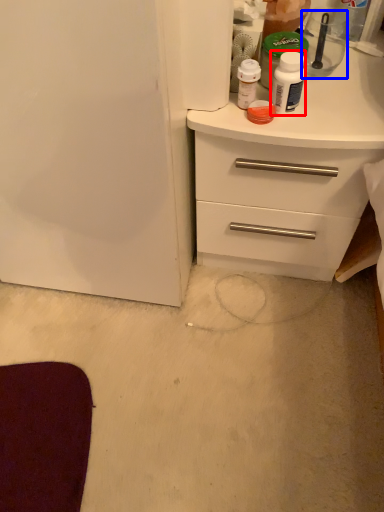
Question: Which point is closer to the camera, bottle (highlighted by a red box) or appliance (highlighted by a blue box)?

Choices:
 (A) bottle
 (B) appliance

Answer: (A)